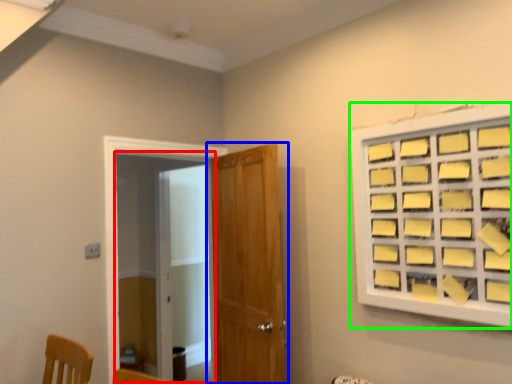
Question: Considering the real-world distances, which object is closest to screen door (highlighted by a red box)? door (highlighted by a blue box) or window (highlighted by a green box).

Choices:
 (A) door
 (B) window

Answer: (A)